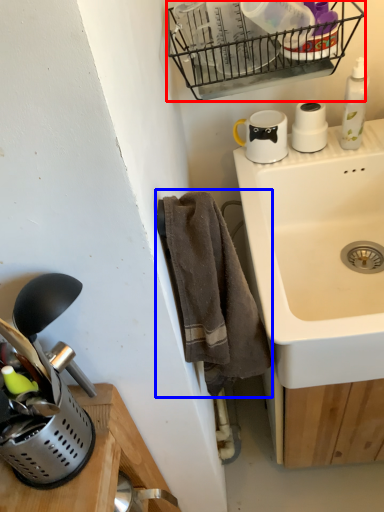
Question: Among these objects, which one is farthest to the camera, basket (highlighted by a red box) or bath towel (highlighted by a blue box)?

Choices:
 (A) basket
 (B) bath towel

Answer: (A)